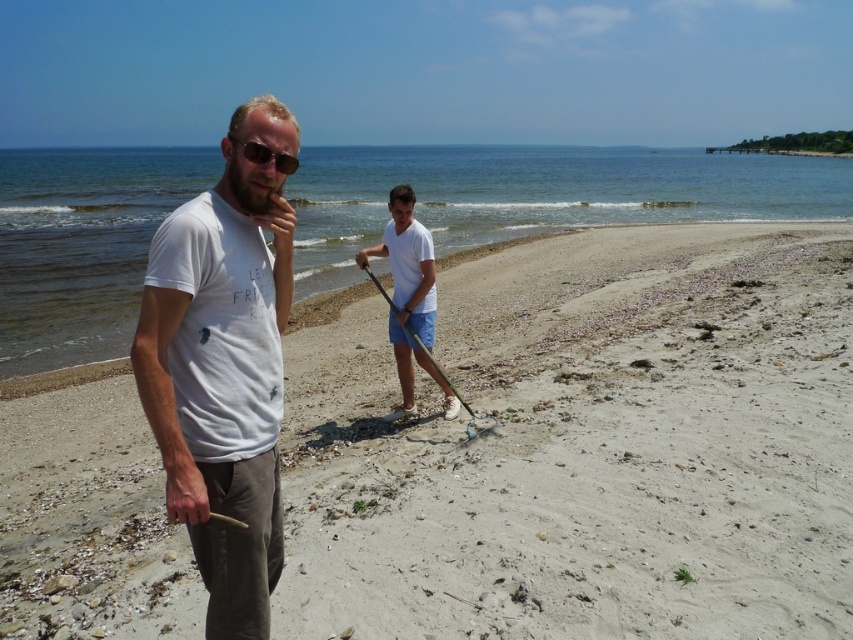
Is white matte shirt at center bigger than matte black sunglasses at center?

Yes.

Who is more distant from viewer, (399,317) or (291,161)?

The point (399,317) is more distant.

Locate an element on the screen. The width and height of the screenshot is (853, 640). white matte shirt at center is located at coordinates (409, 298).

Does point (389, 595) come behind point (409, 189)?

No, it is in front of (409, 189).

Who is more distant from viewer, [758,259] or [398,220]?

Point [758,259]

Image resolution: width=853 pixels, height=640 pixels. In order to click on white sandy beach at center in this screenshot , I will do `click(585, 448)`.

Does point (759, 477) come closer to viewer compared to point (245, 180)?

No, it is not.

Can you confirm if white sandy beach at center is wider than white cotton t-shirt at left?

Correct, the width of white sandy beach at center exceeds that of white cotton t-shirt at left.

What do you see at coordinates (585, 448) in the screenshot? The height and width of the screenshot is (640, 853). I see `white sandy beach at center` at bounding box center [585, 448].

Find the location of `white sandy beach at center`. white sandy beach at center is located at coordinates (585, 448).